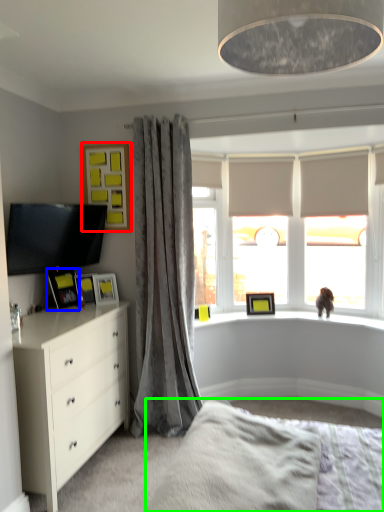
Question: Considering the real-world distances, which object is farthest from picture frame (highlighted by a red box)? picture frame (highlighted by a blue box) or bed frame (highlighted by a green box)?

Choices:
 (A) picture frame
 (B) bed frame

Answer: (B)